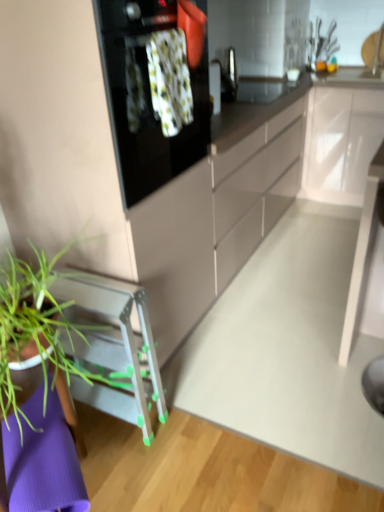
This screenshot has width=384, height=512. Identify the location of vacant space underneath white glossy table at center (from a real-world perspective). (359, 400).